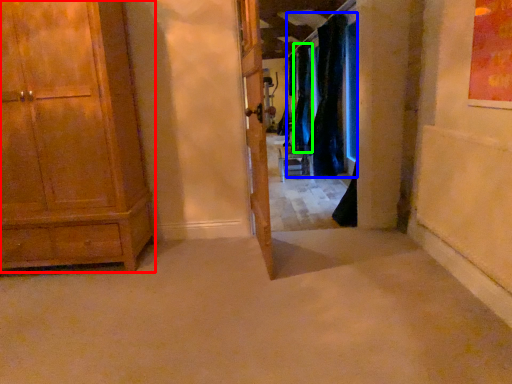
Question: Which is farther away from cabinetry (highlighted by a red box)? curtain (highlighted by a blue box) or curtain (highlighted by a green box)?

Choices:
 (A) curtain
 (B) curtain

Answer: (B)